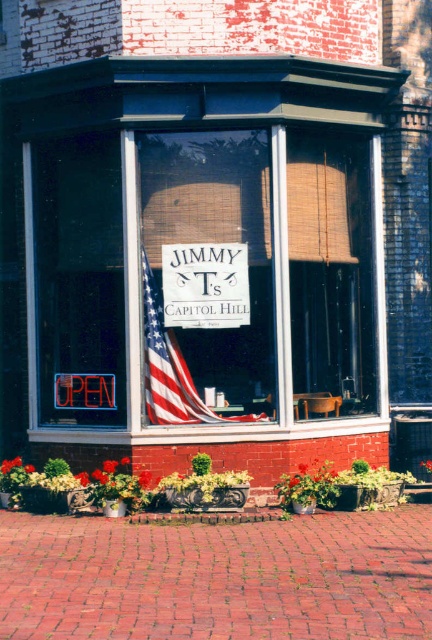
You are a delivery person with a package that needs to be placed between the white wood sign at center and the american flag at center. The package measures 15 inches in length. Can you fit it between them without moving either object?

The distance between the white wood sign at center and the american flag at center is 14.88 inches, so the 15 inch package cannot fit between them without moving either object.

In the scene shown: You are a customer approaching the storefront of Jimmy T. You notice the white wood sign at center and the american flag at center. Which object is positioned higher up on the storefront?

The white wood sign at center is located above the american flag at center, so it is positioned higher up on the storefront.